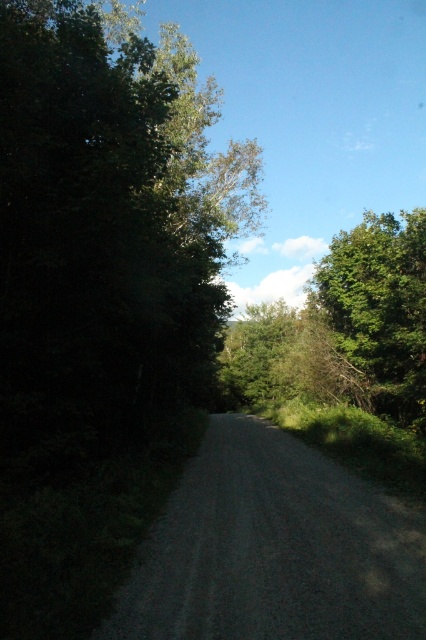
Question: Which point is closer to the camera?

Choices:
 (A) (405, 541)
 (B) (333, 320)

Answer: (A)

Question: Where is gray gravel road at center located in relation to green leafy tree at right in the image?

Choices:
 (A) right
 (B) left

Answer: (B)

Question: In this image, where is gray gravel road at center located relative to green leafy tree at right?

Choices:
 (A) left
 (B) right

Answer: (A)

Question: Is gray gravel road at center above green leafy tree at right?

Choices:
 (A) yes
 (B) no

Answer: (B)